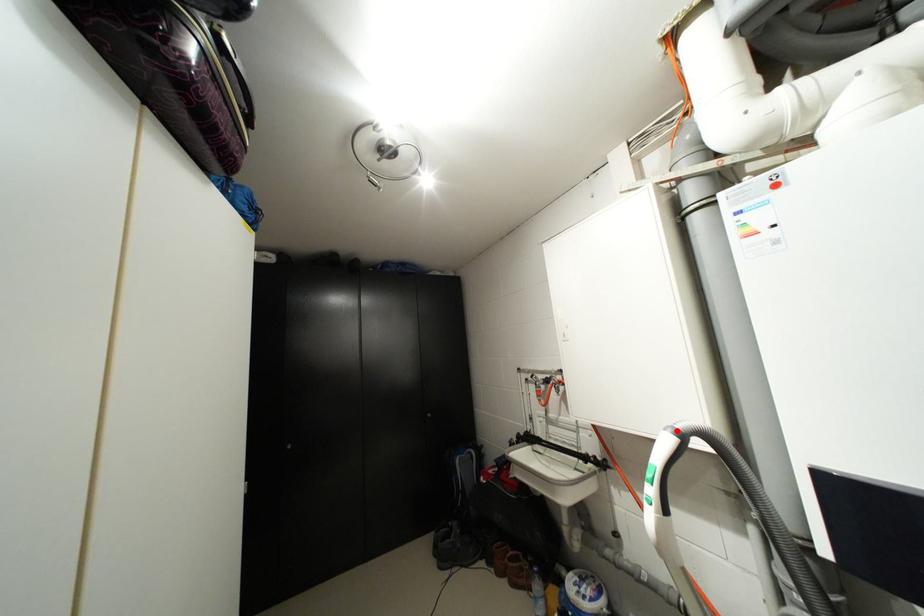
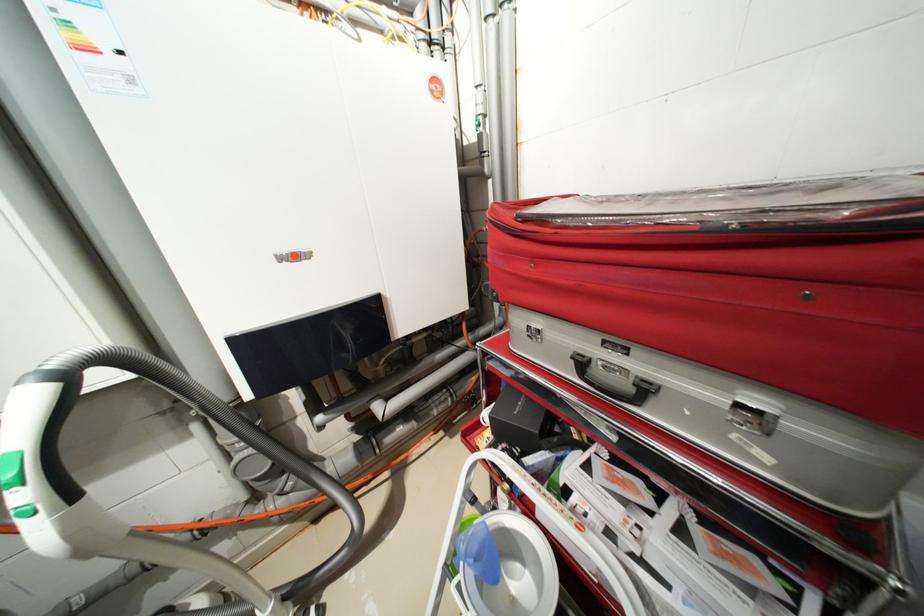
Find the pixel in the second image that matches the highlighted location in the first image.

(40, 379)